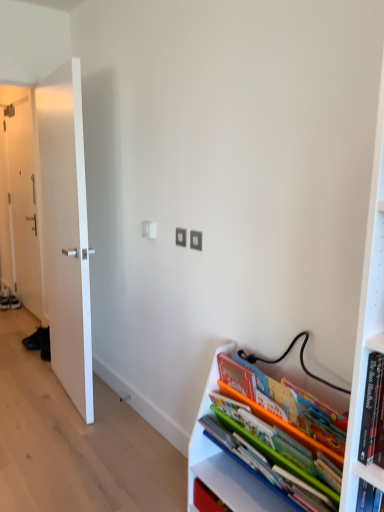
Find the location of `free space on the front side of white matte door at left, the 1th door viewed from the back`. free space on the front side of white matte door at left, the 1th door viewed from the back is located at coordinates (12, 320).